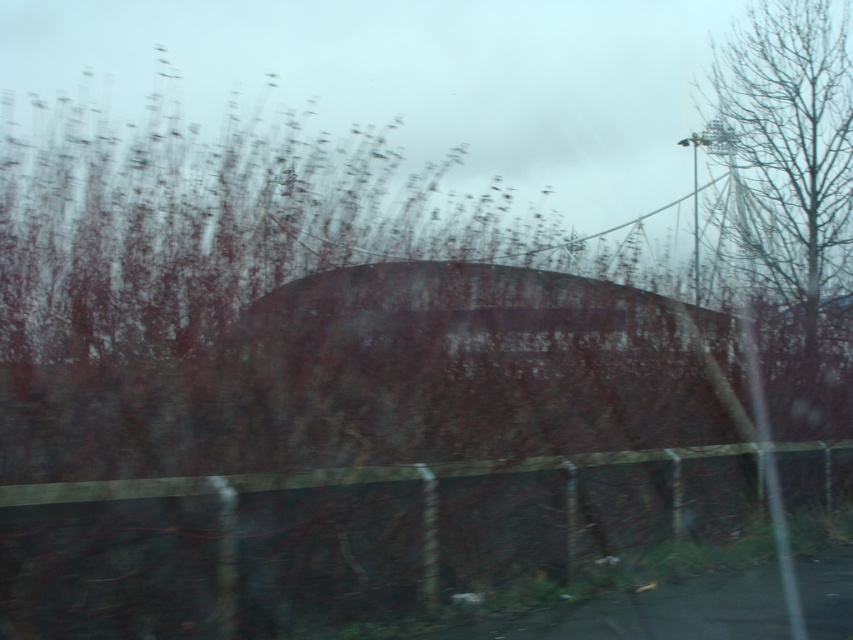
Question: Which of the following is the closest to the observer?

Choices:
 (A) bare branches at upper right
 (B) wooden fence at center

Answer: (B)

Question: Is wooden fence at center below bare branches at upper right?

Choices:
 (A) yes
 (B) no

Answer: (A)

Question: Can you confirm if wooden fence at center is positioned above bare branches at upper right?

Choices:
 (A) no
 (B) yes

Answer: (A)

Question: Can you confirm if wooden fence at center is positioned to the left of bare branches at upper right?

Choices:
 (A) yes
 (B) no

Answer: (A)

Question: Which of the following is the closest to the observer?

Choices:
 (A) wooden fence at center
 (B) bare branches at upper right

Answer: (A)